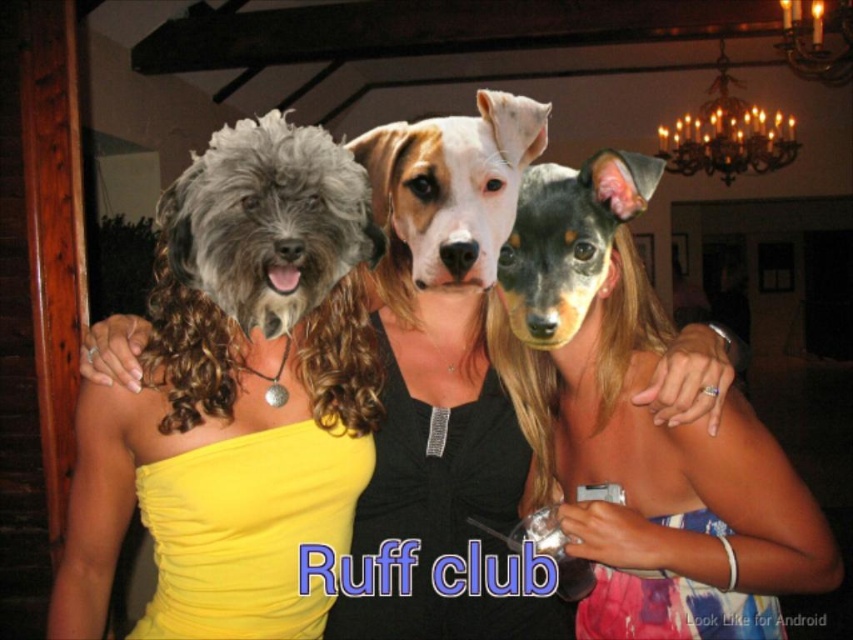
You are a photographer trying to capture a group photo of the matte black dress at center and the white fur dog at center. Since the two subjects are the same size, will you need to adjust your camera angle to ensure both fit in the frame?

The matte black dress at center is wider than the white fur dog at center, so you should position the camera to focus on the wider area of the matte black dress at center to ensure both subjects fit in the frame.

In the image, there are two people with dog heads. The first is wearing a yellow satin dress at left, and the second has black and tan fur at center. From the perspective of someone standing in front of them, which one is positioned more to the left?

The yellow satin dress at left is positioned more to the left than the black and tan fur at center.

You are standing at the origin point in the image. Which of the two points, point (606, 168) or point (541, 125), is closer to you?

Point (606, 168) is closer to you because it is in front of point (541, 125).